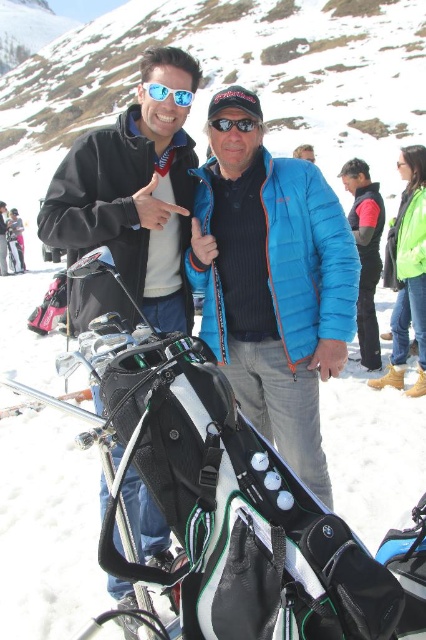
Question: Considering the real-world distances, which object is farthest from the matte black jacket at left?

Choices:
 (A) blue quilted jacket at right
 (B) black matte sunglasses at center

Answer: (A)

Question: Can you confirm if matte black jacket at left is positioned to the right of matte black jacket at center?

Choices:
 (A) no
 (B) yes

Answer: (B)

Question: Does blue quilted jacket at center appear over matte black jacket at left?

Choices:
 (A) yes
 (B) no

Answer: (A)

Question: Estimate the real-world distances between objects in this image. Which object is closer to the blue reflective sunglasses at upper center?

Choices:
 (A) blue quilted jacket at center
 (B) green matte jacket at right
 (C) matte black jacket at left
 (D) blue quilted jacket at right

Answer: (C)

Question: Which point is closer to the camera?

Choices:
 (A) blue quilted jacket at right
 (B) matte black jacket at left
 (C) blue reflective sunglasses at upper center
 (D) blue quilted jacket at center

Answer: (B)

Question: In this image, where is blue quilted jacket at center located relative to green matte jacket at right?

Choices:
 (A) below
 (B) above

Answer: (A)